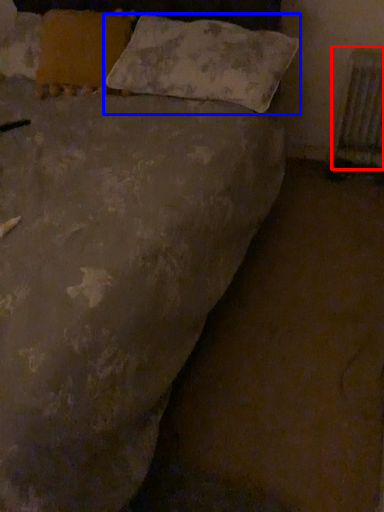
Question: Which of the following is the farthest to the observer, radiator (highlighted by a red box) or pillow (highlighted by a blue box)?

Choices:
 (A) radiator
 (B) pillow

Answer: (A)